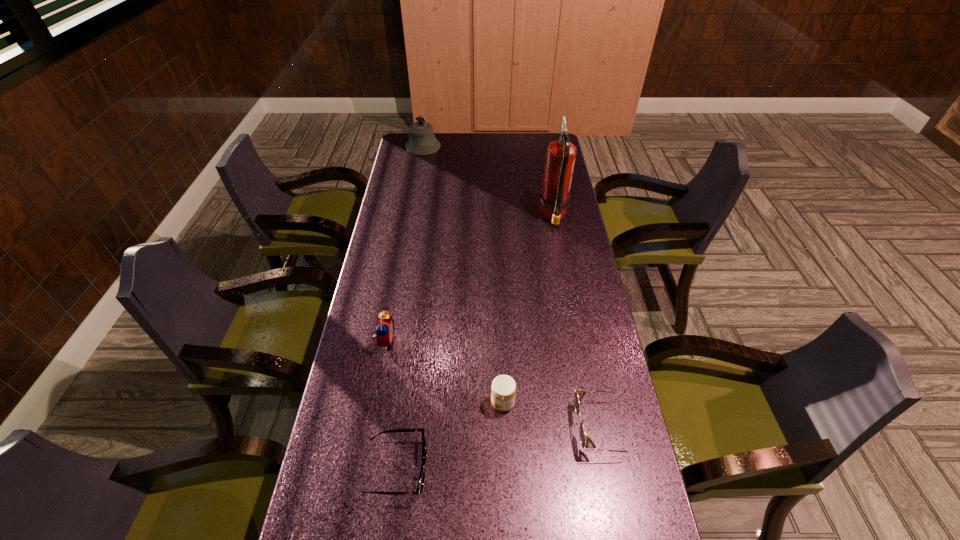
Find the location of a particular element. Image resolution: width=960 pixels, height=540 pixels. vacant space at the left edge of the desktop is located at coordinates (343, 424).

This screenshot has width=960, height=540. What are the coordinates of `vacant space at the right edge of the desktop` in the screenshot? It's located at tap(574, 215).

In order to click on free spot at the far left corner of the desktop in this screenshot , I will do `click(408, 157)`.

You are a GUI agent. You are given a task and a screenshot of the screen. Output one action in this format:
    pyautogui.click(x=<x>, y=<y>)
    Task: Click on the vacant space that is in between the second tallest object and the taller sunglasses
    This screenshot has width=960, height=540.
    Given the screenshot: What is the action you would take?
    pyautogui.click(x=513, y=287)

Where is `free point between the tallest object and the farthest object`? This screenshot has width=960, height=540. free point between the tallest object and the farthest object is located at coordinates (488, 181).

This screenshot has height=540, width=960. What are the coordinates of `free space between the tallest object and the jam` in the screenshot? It's located at (528, 309).

This screenshot has height=540, width=960. I want to click on free space that is in between the third object from right to left and the fifth tallest object, so click(553, 415).

Locate an element on the screen. The height and width of the screenshot is (540, 960). free spot between the taller sunglasses and the fire extinguisher is located at coordinates (578, 322).

You are a GUI agent. You are given a task and a screenshot of the screen. Output one action in this format:
    pyautogui.click(x=<x>, y=<y>)
    Task: Click on the free space between the farthest object and the fourth nearest object
    
    Given the screenshot: What is the action you would take?
    pyautogui.click(x=404, y=244)

Where is `free space between the right sunglasses and the fifth shortest object`? The height and width of the screenshot is (540, 960). free space between the right sunglasses and the fifth shortest object is located at coordinates (513, 287).